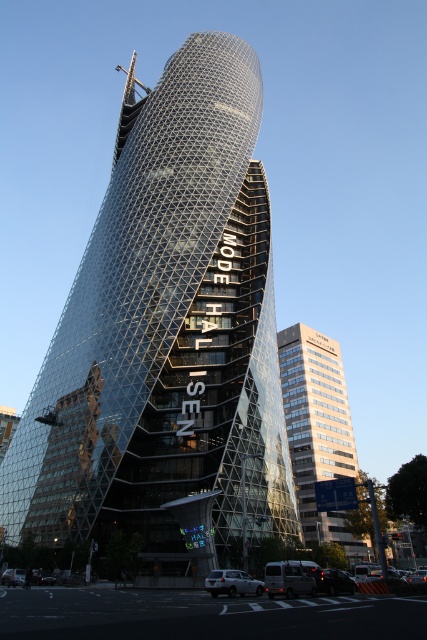
You are standing in front of the Mode Gakuen Cocoon Tower and notice a point marked at coordinates (x=333, y=580). What object is located at this point?

The point at (x=333, y=580) corresponds to a silver metallic van at lower center.

You are an architect analyzing the Cocoon Tower in Nagoya. You observe the transparent glass tower at center and the light beige glass building at center. Which one is positioned higher in the image?

The transparent glass tower at center is located above the light beige glass building at center, so it is positioned higher in the image.

You are a drone operator planning to fly a drone from the point at coordinate point at (x=234, y=445) to the top of the Cocoon Tower. The drone has a maximum flight range of 60 meters. Will the drone be able to reach the top of the Cocoon Tower from that point?

The distance between the point at (x=234, y=445) and the top of the Cocoon Tower is 63.07 meters, which exceeds the drone operator maximum flight range of 60 meters. Therefore, the drone will not be able to reach the top of the Cocoon Tower from that point.